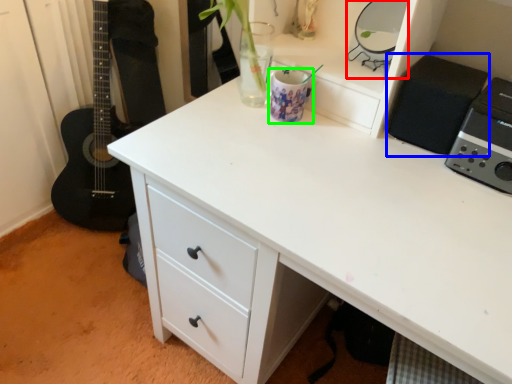
Question: Which object is the farthest from appliance (highlighted by a red box)? Choose among these: appliance (highlighted by a blue box) or appliance (highlighted by a green box).

Choices:
 (A) appliance
 (B) appliance

Answer: (B)